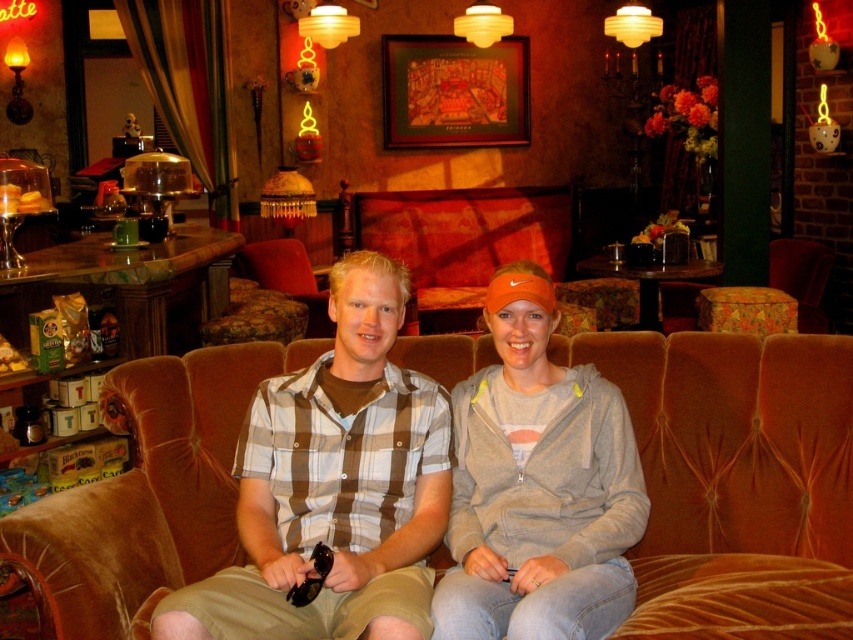
Please identify the clothing item located at the coordinates point (334, 484) in the scene. The scene has a brown velvet sofa with two people sitting on it. The options are plaid shirt at center and gray zip hoodie at right.

The point (334, 484) indicates the plaid shirt at center.

You are a photographer setting up a shoot in this cozy interior space. You have a backdrop that is 1.8 meters wide. The velvet brown couch at center and the plaid shirt at center are both in the scene. Which object would the backdrop fit over without needing to be adjusted in size?

The velvet brown couch at center has a greater width than the plaid shirt at center. Since the backdrop is 1.8 meters wide, it would fit over the velvet brown couch at center as it is wider than the plaid shirt at center.